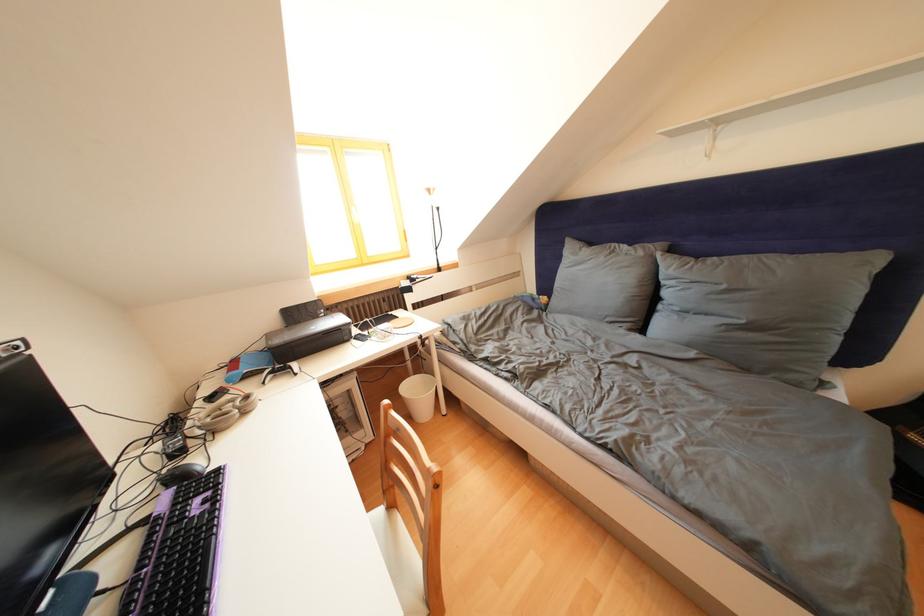
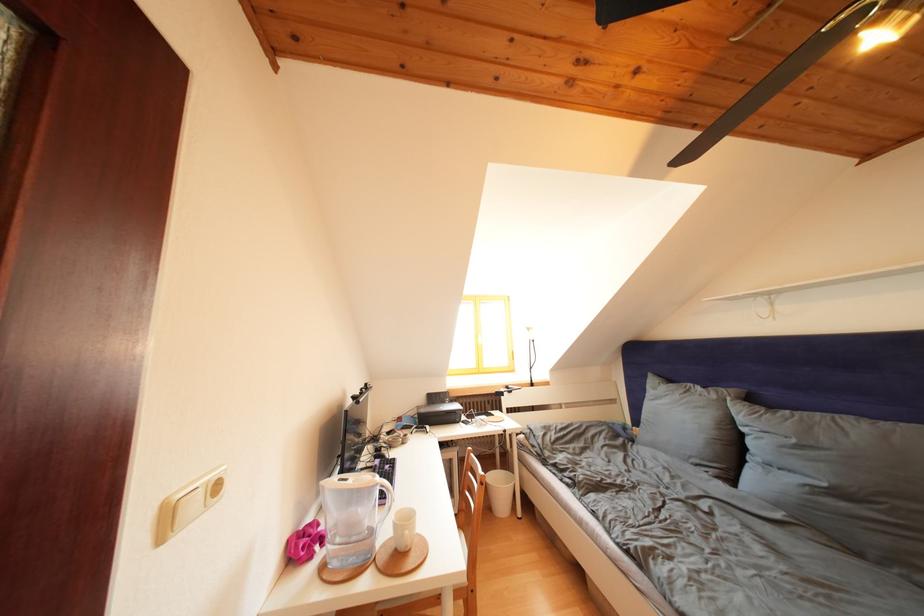
Locate, in the second image, the point that corresponds to (649,259) in the first image.

(722, 402)